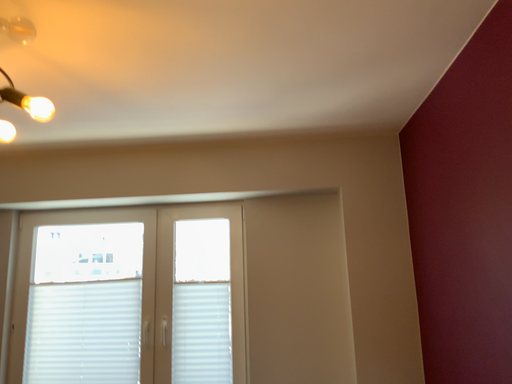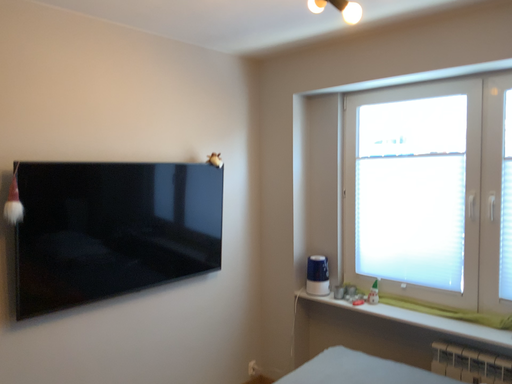
Question: Which way did the camera rotate in the video?

Choices:
 (A) rotated downward
 (B) rotated upward

Answer: (A)